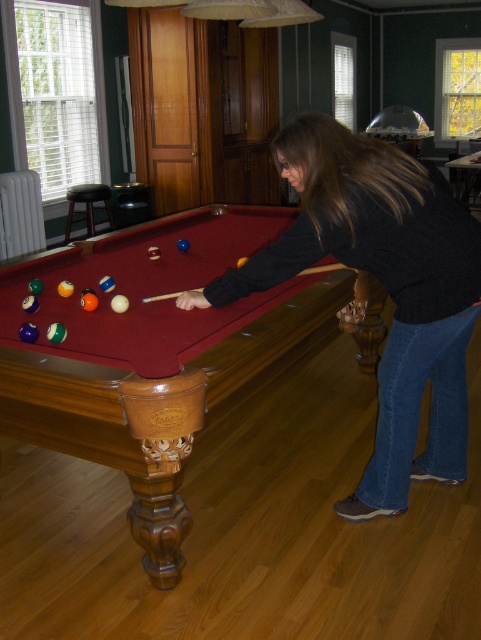
You are standing near the black leather stool at left and want to reach the wooden pool table at center. Which direction should you move to get there?

The wooden pool table at center is in front of the black leather stool at left, so you should move forward to reach it.

You are standing at the entrance of the room and want to approach the wooden pool table at center. Based on the coordinates provided, in which direction should you move from your current position to reach the table?

The wooden pool table at center is located at coordinates point (151, 349). Since you are at the entrance, you should move towards the center of the room to reach it, as the table is centrally positioned.